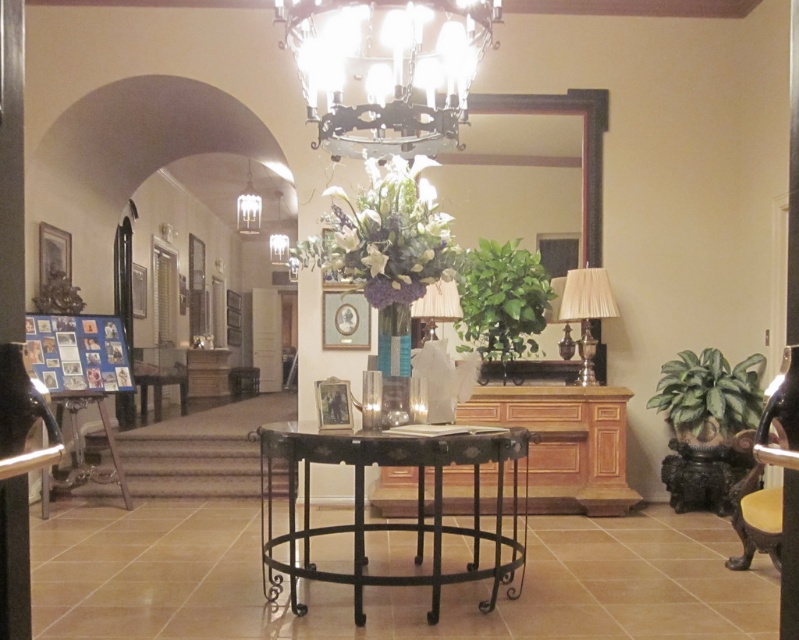
Is point (287, 481) farther from viewer compared to point (277, 193)?

No.

Is point (378, 444) positioned behind point (269, 243)?

That is False.

Find the location of a particular element. black wrought iron table at center is located at coordinates (390, 522).

Between metallic chandelier at upper center and green leafy plant at center, which one is positioned higher?

Positioned higher is metallic chandelier at upper center.

Who is taller, metallic chandelier at upper center or green leafy plant at center?

With more height is green leafy plant at center.

What do you see at coordinates (386, 68) in the screenshot? I see `metallic chandelier at upper center` at bounding box center [386, 68].

Identify the location of metallic chandelier at upper center. (386, 68).

Is point (730, 396) closer to camera compared to point (117, 476)?

Yes, point (730, 396) is in front of point (117, 476).

I want to click on green glossy leafy plant at right, so click(708, 396).

Which is behind, point (730, 396) or point (101, 397)?

Positioned behind is point (101, 397).

The image size is (799, 640). I want to click on green glossy leafy plant at right, so click(x=708, y=396).